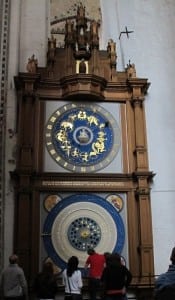
Where is `sculpture`? This screenshot has width=175, height=300. sculpture is located at coordinates (x=93, y=89).